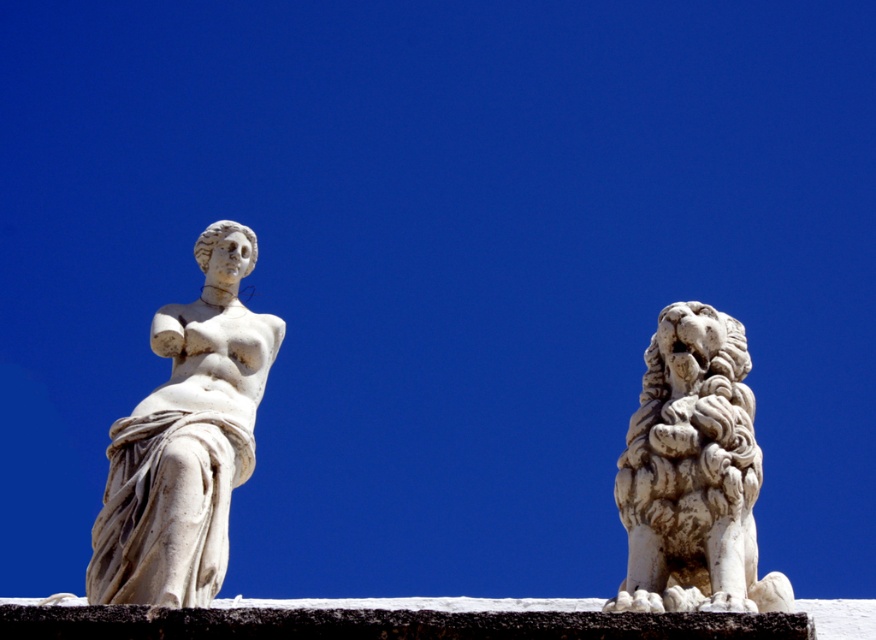
You are an art curator planning to move the white marble statue at left and the white stone lion at right to a new gallery layout. If you want to keep their original left to right arrangement but swap their positions, which statue should be placed where?

To maintain the original left to right arrangement while swapping their positions, the white marble statue at left should be moved to the right side of the white stone lion at right, and the white stone lion at right should be placed on the left side of the white marble statue at left.

You are a photographer standing at the camera position. You want to take a closeup shot of the white marble statue at left. Given that your camera can focus on objects within 50 meters, will you be able to capture a clear image?

The white marble statue at left is 59.76 meters away from camera, which is beyond the camera focus range of 50 meters. Therefore, the camera cannot capture a clear image of the white marble statue at left.

You are an art curator planning to display both the white marble statue at left and the white stone lion at right in a new exhibition. Given their sizes, which one would require a larger base to ensure stability?

The white stone lion at right requires a larger base because it is bigger in size compared to the white marble statue at left.